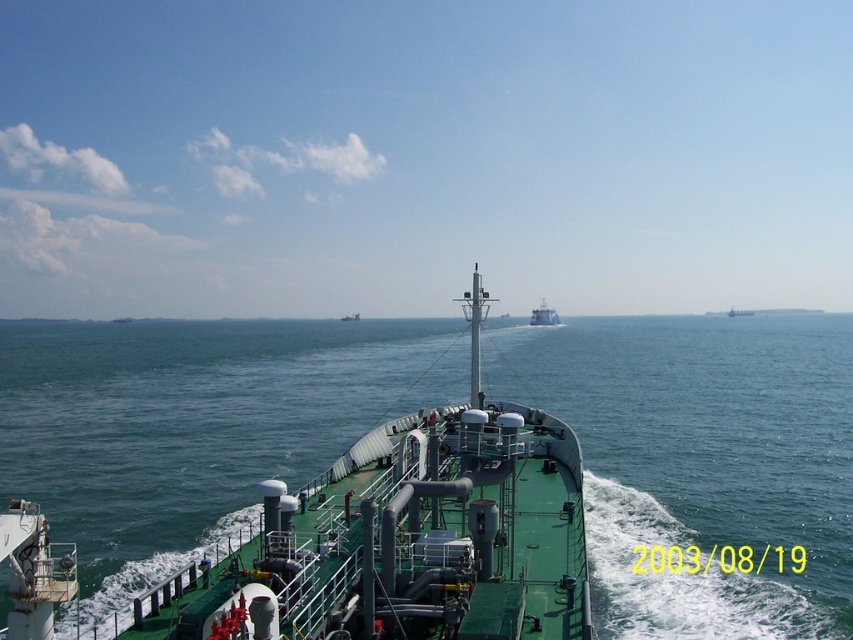
Question: Is white glossy boat at center to the right of green matte ship at center from the viewer's perspective?

Choices:
 (A) yes
 (B) no

Answer: (A)

Question: Which object is closer to the camera taking this photo?

Choices:
 (A) white glossy boat at center
 (B) green water at center

Answer: (B)

Question: Observing the image, what is the correct spatial positioning of green water at center in reference to white glossy boat at center?

Choices:
 (A) left
 (B) right

Answer: (A)

Question: Which point is closer to the camera taking this photo?

Choices:
 (A) (347, 317)
 (B) (173, 460)

Answer: (B)

Question: Does green water at center have a greater width compared to green matte ship at center?

Choices:
 (A) yes
 (B) no

Answer: (A)

Question: Which of the following is the farthest from the observer?

Choices:
 (A) [x=91, y=541]
 (B) [x=341, y=317]
 (C) [x=534, y=323]

Answer: (B)